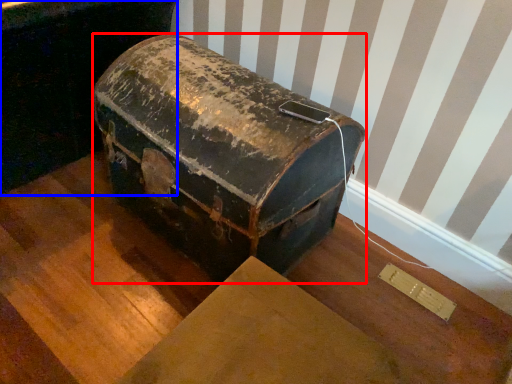
Question: Which of the following is the closest to the observer, suitcase (highlighted by a red box) or furniture (highlighted by a blue box)?

Choices:
 (A) suitcase
 (B) furniture

Answer: (A)